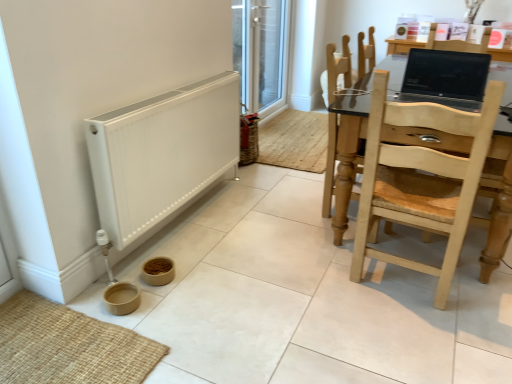
Identify the location of vacant space situated on the left part of light brown wooden chair at right, which is the 2th chair from front to back. (290, 208).